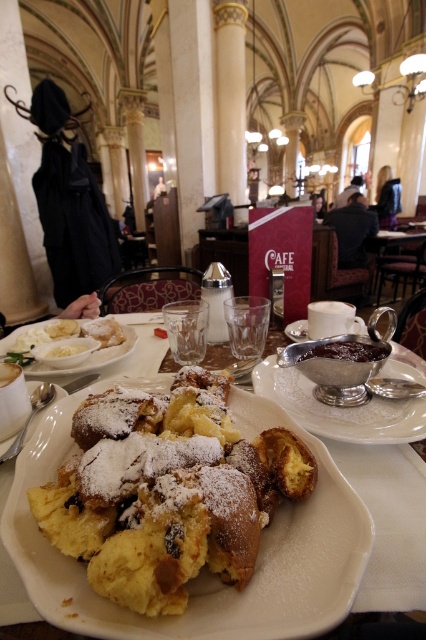
Question: Can you confirm if powdered sugar pastry at lower left is thinner than silver metallic saucer at center?

Choices:
 (A) no
 (B) yes

Answer: (A)

Question: Is powdered sugar pastry at lower left bigger than dark chocolate spread at center?

Choices:
 (A) yes
 (B) no

Answer: (A)

Question: Among these points, which one is farthest from the camera?

Choices:
 (A) (78, 368)
 (B) (276, 636)
 (C) (420, 406)
 (D) (333, 349)

Answer: (A)

Question: Among these objects, which one is farthest from the camera?

Choices:
 (A) silver metallic bowl at center
 (B) silver metallic saucer at center

Answer: (B)

Question: Estimate the real-world distances between objects in this image. Which object is farther from the powdery golden pastry at center?

Choices:
 (A) silver metallic saucer at center
 (B) powdered sugar pastry at lower left
 (C) silver metallic bowl at center
 (D) dark chocolate spread at center

Answer: (A)

Question: Does silver metallic bowl at center have a larger size compared to silver metallic saucer at center?

Choices:
 (A) yes
 (B) no

Answer: (A)